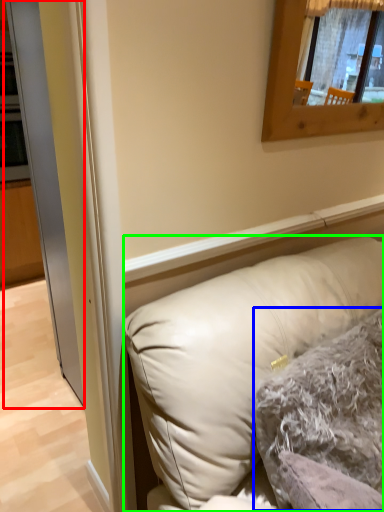
Question: Estimate the real-world distances between objects in this image. Which object is closer to glass door (highlighted by a red box), pillow (highlighted by a blue box) or pillow (highlighted by a green box)?

Choices:
 (A) pillow
 (B) pillow

Answer: (B)